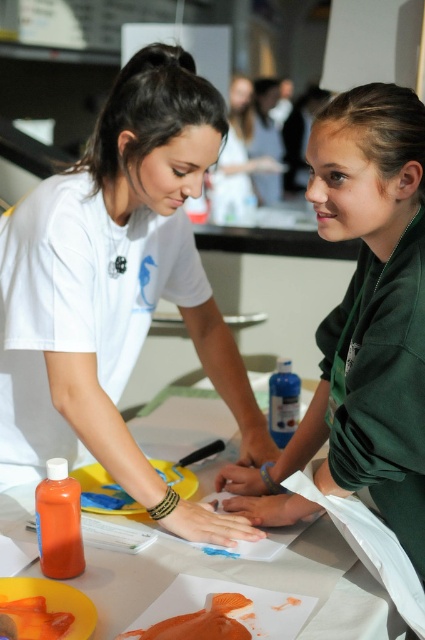
Measure the distance from white paper at center to orange matte fish at center.

white paper at center is 9.09 inches away from orange matte fish at center.

What do you see at coordinates (246, 582) in the screenshot?
I see `white paper at center` at bounding box center [246, 582].

Between point (118, 592) and point (184, 632), which one is positioned behind?

The point (118, 592) is more distant.

Where is `white paper at center`? white paper at center is located at coordinates pos(246,582).

I want to click on white paper at center, so click(x=246, y=582).

Based on the photo, is white paper at center positioned at the back of orange matte food at lower left?

Yes, white paper at center is further from the viewer.

Is point (172, 406) more distant than point (5, 604)?

Yes, point (172, 406) is farther from viewer.

I want to click on white paper at center, so 246,582.

Can you confirm if green matte shirt at center is positioned to the right of orange matte food at lower left?

Correct, you'll find green matte shirt at center to the right of orange matte food at lower left.

Between point (382, 488) and point (17, 624), which one is positioned in front?

Positioned in front is point (17, 624).

What are the coordinates of `green matte shirt at center` in the screenshot? It's located at (362, 323).

I want to click on green matte shirt at center, so click(362, 323).